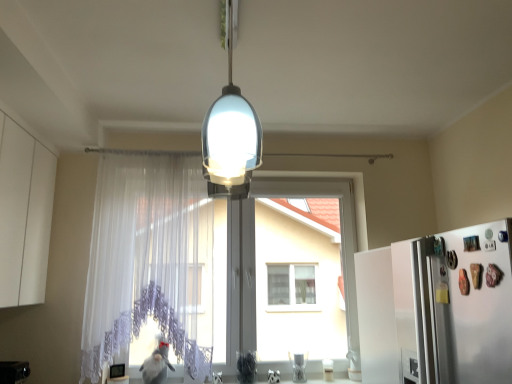
This screenshot has width=512, height=384. What do you see at coordinates (24, 215) in the screenshot?
I see `white matte cabinet at left` at bounding box center [24, 215].

The image size is (512, 384). Describe the element at coordinates (149, 259) in the screenshot. I see `white sheer curtain at center` at that location.

Image resolution: width=512 pixels, height=384 pixels. I want to click on white matte refrigerator at right, so click(x=438, y=308).

Is white matte refrigerator at right placed right next to translucent glass lampshade at center?

No, white matte refrigerator at right is not next to translucent glass lampshade at center.

Which object is closer to the camera taking this photo, white matte refrigerator at right or translucent glass lampshade at center?

translucent glass lampshade at center is closer to the camera.

From a real-world perspective, who is located higher, white matte refrigerator at right or translucent glass lampshade at center?

From a 3D spatial view, translucent glass lampshade at center is above.

In terms of width, does white matte refrigerator at right look wider or thinner when compared to translucent glass lampshade at center?

Clearly, white matte refrigerator at right has more width compared to translucent glass lampshade at center.

Which is behind, point (46, 272) or point (290, 187)?

The point (290, 187) is farther.

In the scene shown: Is there a large distance between white matte cabinet at left and transparent lace curtain at center?

That's right, there is a large distance between white matte cabinet at left and transparent lace curtain at center.

Considering the relative sizes of white matte cabinet at left and transparent lace curtain at center in the image provided, is white matte cabinet at left smaller than transparent lace curtain at center?

Correct, white matte cabinet at left occupies less space than transparent lace curtain at center.

Considering the relative sizes of white matte cabinet at left and transparent lace curtain at center in the image provided, is white matte cabinet at left thinner than transparent lace curtain at center?

Incorrect, the width of white matte cabinet at left is not less than that of transparent lace curtain at center.

Locate an element on the screen. Image resolution: width=512 pixels, height=384 pixels. curtain below the translucent glass lampshade at center (from the image's perspective) is located at coordinates (149, 259).

Looking at this image, visually, is white sheer curtain at center positioned to the left or to the right of translucent glass lampshade at center?

white sheer curtain at center is positioned on translucent glass lampshade at center's left side.

Between point (126, 335) and point (214, 175), which one is positioned in front?

Positioned in front is point (214, 175).

Considering the sizes of white sheer curtain at center and translucent glass lampshade at center in the image, is white sheer curtain at center taller or shorter than translucent glass lampshade at center?

Considering their sizes, white sheer curtain at center has more height than translucent glass lampshade at center.

From the image's perspective, would you say translucent glass lampshade at center is positioned over white sheer curtain at center?

Indeed, from the image's perspective, translucent glass lampshade at center is shown above white sheer curtain at center.

Which of these two, translucent glass lampshade at center or white sheer curtain at center, is bigger?

white sheer curtain at center is bigger.

How distant is translucent glass lampshade at center from white sheer curtain at center?

translucent glass lampshade at center and white sheer curtain at center are 1.14 meters apart from each other.

Considering the positions of objects translucent glass lampshade at center and white sheer curtain at center in the image provided, who is more to the right, translucent glass lampshade at center or white sheer curtain at center?

translucent glass lampshade at center.

Based on the photo, can you confirm if white sheer curtain at center is shorter than white matte refrigerator at right?

No.

How much distance is there between white sheer curtain at center and white matte refrigerator at right?

A distance of 4.23 feet exists between white sheer curtain at center and white matte refrigerator at right.

From the image's perspective, would you say white sheer curtain at center is shown under white matte refrigerator at right?

No, from the image's perspective, white sheer curtain at center is not below white matte refrigerator at right.

Would you say white matte refrigerator at right is part of white sheer curtain at center's contents?

Definitely not — white matte refrigerator at right is not inside white sheer curtain at center.

From the image's perspective, is white matte cabinet at left on white sheer curtain at center?

Yes.

In the scene shown: Considering the relative sizes of white matte cabinet at left and white sheer curtain at center in the image provided, is white matte cabinet at left shorter than white sheer curtain at center?

Yes, white matte cabinet at left is shorter than white sheer curtain at center.

Measure the distance from white matte cabinet at left to white sheer curtain at center.

white matte cabinet at left and white sheer curtain at center are 57.59 centimeters apart.

Considering the positions of point (27, 154) and point (136, 266), is point (27, 154) closer or farther from the camera than point (136, 266)?

Point (27, 154) is closer to the camera than point (136, 266).

Is white sheer curtain at center not inside white matte cabinet at left?

Absolutely, white sheer curtain at center is external to white matte cabinet at left.

Considering the sizes of objects white sheer curtain at center and white matte cabinet at left in the image provided, who is shorter, white sheer curtain at center or white matte cabinet at left?

white matte cabinet at left.

Between white sheer curtain at center and white matte cabinet at left, which one is positioned behind?

white sheer curtain at center.

Where is `fridge lying behind the translucent glass lampshade at center`? Image resolution: width=512 pixels, height=384 pixels. fridge lying behind the translucent glass lampshade at center is located at coordinates click(438, 308).

The width and height of the screenshot is (512, 384). There is a transparent lace curtain at center. Identify the location of cabinetry above it (from a real-world perspective). coord(24,215).

Considering their positions, is white matte refrigerator at right positioned further to translucent glass lampshade at center than white sheer curtain at center?

white sheer curtain at center.

When comparing their distances from translucent glass lampshade at center, does transparent lace curtain at center or white matte cabinet at left seem closer?

white matte cabinet at left lies closer to translucent glass lampshade at center than the other object.

Looking at the image, which one is located closer to white matte cabinet at left, translucent glass lampshade at center or white matte refrigerator at right?

translucent glass lampshade at center lies closer to white matte cabinet at left than the other object.

Consider the image. Based on their spatial positions, is transparent lace curtain at center or translucent glass lampshade at center further from white sheer curtain at center?

The object further to white sheer curtain at center is translucent glass lampshade at center.

Looking at the image, which one is located closer to translucent glass lampshade at center, white matte cabinet at left or transparent lace curtain at center?

white matte cabinet at left lies closer to translucent glass lampshade at center than the other object.

Looking at the image, which one is located further to white matte refrigerator at right, white matte cabinet at left or white sheer curtain at center?

white matte cabinet at left is positioned further to the anchor white matte refrigerator at right.

Which object lies nearer to the anchor point white matte cabinet at left, white sheer curtain at center or transparent lace curtain at center?

white sheer curtain at center lies closer to white matte cabinet at left than the other object.

Based on their spatial positions, is white sheer curtain at center or transparent lace curtain at center closer to white matte refrigerator at right?

Based on the image, transparent lace curtain at center appears to be nearer to white matte refrigerator at right.

This screenshot has width=512, height=384. In order to click on curtain between translucent glass lampshade at center and transparent lace curtain at center along the z-axis in this screenshot , I will do `click(149, 259)`.

This screenshot has height=384, width=512. Identify the location of window screen situated between white matte cabinet at left and white matte refrigerator at right from left to right. (254, 254).

Locate an element on the screen. This screenshot has width=512, height=384. curtain between white matte cabinet at left and transparent lace curtain at center in the horizontal direction is located at coordinates (149, 259).

This screenshot has width=512, height=384. I want to click on lamp between white sheer curtain at center and white matte refrigerator at right, so click(x=230, y=138).